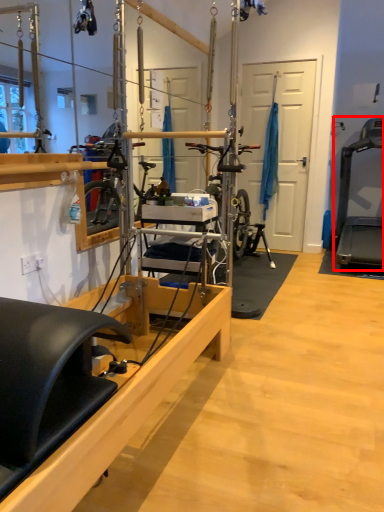
Question: Observing the image, what is the correct spatial positioning of treadmill (annotated by the red box) in reference to furniture?

Choices:
 (A) left
 (B) right

Answer: (B)